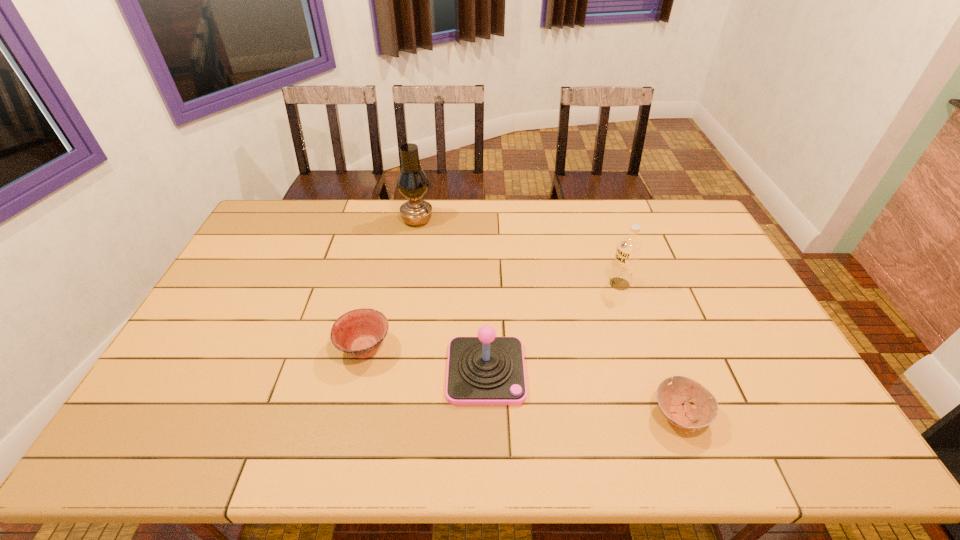
Where is `vacant region at the near edge of the desktop`? This screenshot has height=540, width=960. vacant region at the near edge of the desktop is located at coordinates (552, 441).

The width and height of the screenshot is (960, 540). Identify the location of vacant point at the left edge. (180, 366).

You are a GUI agent. You are given a task and a screenshot of the screen. Output one action in this format:
    pyautogui.click(x=<x>, y=<y>)
    Task: Click on the vacant space at the right edge of the desktop
    Image resolution: width=960 pixels, height=540 pixels.
    Given the screenshot: What is the action you would take?
    pyautogui.click(x=684, y=238)

This screenshot has height=540, width=960. In the image, there is a desktop. Identify the location of vacant space at the far left corner. (275, 236).

What are the coordinates of `blank space at the near right corner` in the screenshot? It's located at (846, 458).

Identify the location of blank region between the shorter bowl and the tallest object. (548, 317).

At what (x,y) coordinates should I click in order to perform the action: click on free space between the shortest object and the tallest object. Please return your answer as a coordinate pair (x, y). Looking at the image, I should click on (548, 317).

This screenshot has width=960, height=540. Find the location of `vacant space that's between the third shortest object and the nearer bowl`. vacant space that's between the third shortest object and the nearer bowl is located at coordinates (583, 393).

This screenshot has width=960, height=540. I want to click on empty location between the shortest object and the vodka, so click(649, 349).

Find the location of a particular element. The image size is (960, 540). vacant area that lies between the oil lamp and the left bowl is located at coordinates (391, 284).